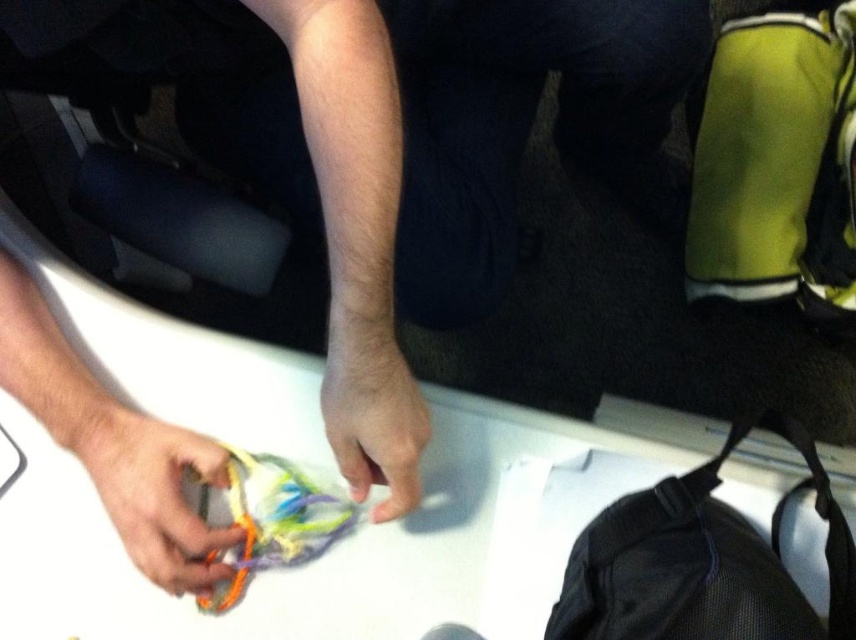
You have a rectangular object that is 20 cm long. You want to place it on the white matte table at center or the black mesh bag at lower right. Which surface can accommodate the object without it hanging off the edge?

The white matte table at center can accommodate the rectangular object since its width is larger than the black mesh bag at lower right, making it more likely to fit the 20 cm long object without overhanging.

You are organizing items on the white matte table at center and the black mesh bag at lower right. If you want to place a new item between them, where should you put it?

You should place the new item between the white matte table at center and the black mesh bag at lower right, as the white matte table at center is on the left side of the black mesh bag at lower right.